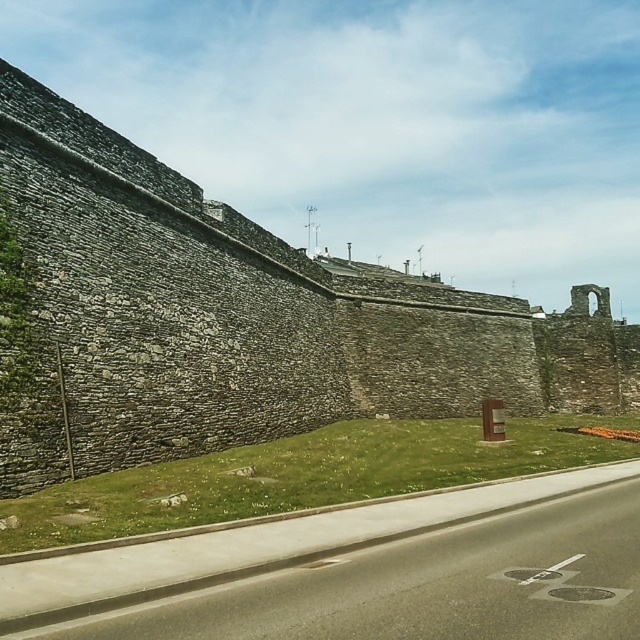
Question: Can you confirm if gray stone wall at center is thinner than green grass at lower center?

Choices:
 (A) no
 (B) yes

Answer: (A)

Question: Can you confirm if gray stone wall at center is smaller than asphalt road at lower center?

Choices:
 (A) no
 (B) yes

Answer: (A)

Question: Based on their relative distances, which object is farther from the gray stone wall at center?

Choices:
 (A) asphalt road at lower center
 (B) green grass at lower center

Answer: (A)

Question: Which point appears closest to the camera in this image?

Choices:
 (A) (246, 433)
 (B) (333, 445)
 (C) (497, 611)

Answer: (C)

Question: Is asphalt road at lower center positioned at the back of green grass at lower center?

Choices:
 (A) yes
 (B) no

Answer: (B)

Question: Among these objects, which one is nearest to the camera?

Choices:
 (A) asphalt road at lower center
 (B) gray stone wall at center
 (C) green grass at lower center

Answer: (A)